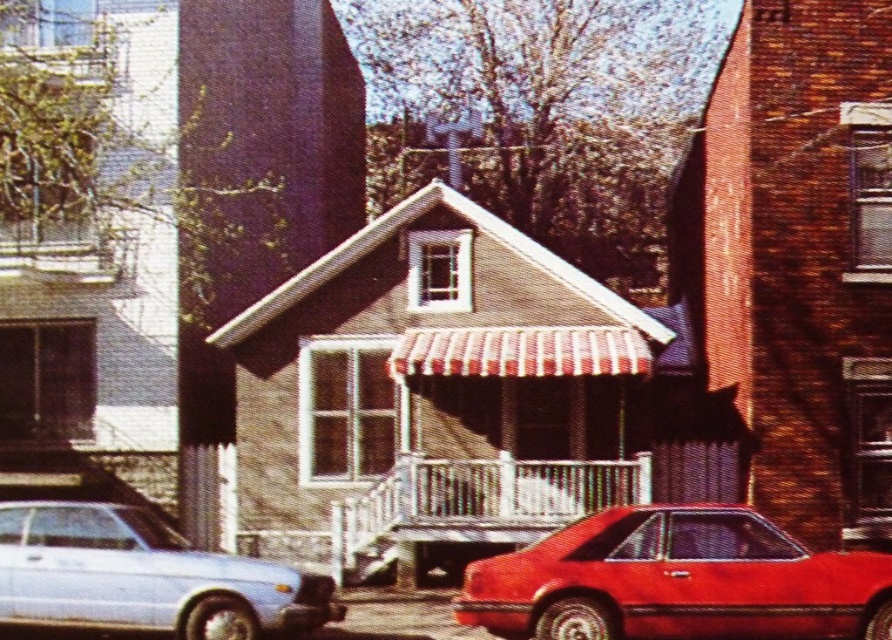
Between shiny red car at lower right and matte silver sedan at lower left, which one appears on the right side from the viewer's perspective?

shiny red car at lower right is more to the right.

Can you confirm if shiny red car at lower right is taller than matte silver sedan at lower left?

Correct, shiny red car at lower right is much taller as matte silver sedan at lower left.

Who is more distant from viewer, (x=746, y=625) or (x=37, y=544)?

The point (x=37, y=544) is more distant.

This screenshot has height=640, width=892. What are the coordinates of `shiny red car at lower right` in the screenshot? It's located at (676, 580).